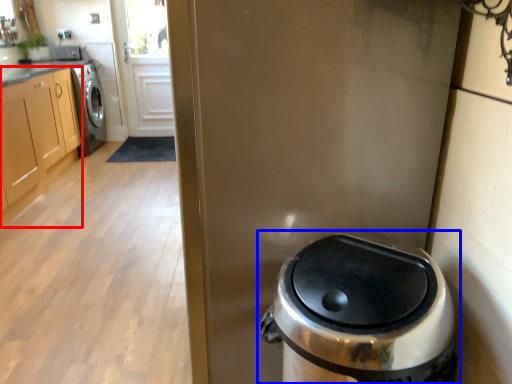
Question: Which object is closer to the camera taking this photo, cabinetry (highlighted by a red box) or waste container (highlighted by a blue box)?

Choices:
 (A) cabinetry
 (B) waste container

Answer: (B)